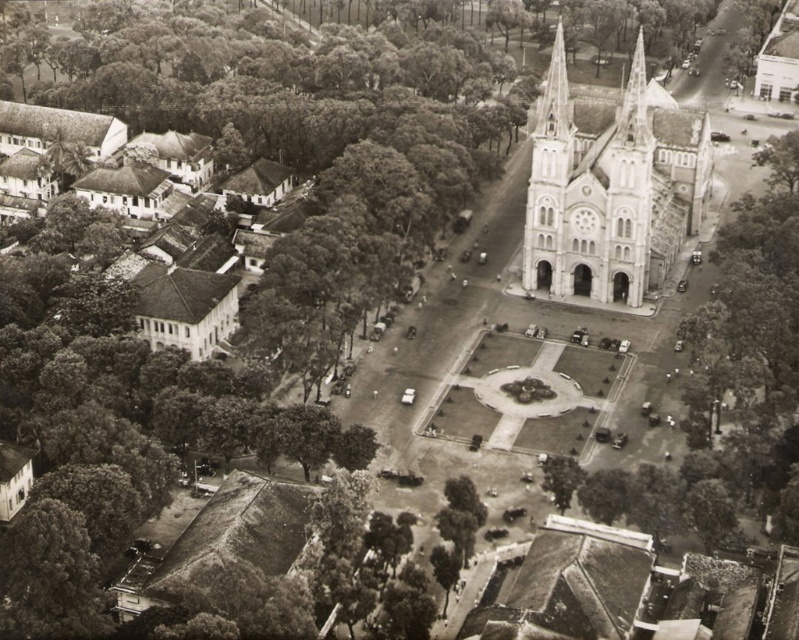
Can you confirm if dark green leafy tree at lower left is positioned below green leafy tree at center?

Indeed, dark green leafy tree at lower left is positioned under green leafy tree at center.

Between dark green leafy tree at lower left and green leafy tree at center, which one appears on the right side from the viewer's perspective?

green leafy tree at center is more to the right.

The width and height of the screenshot is (799, 640). I want to click on dark green leafy tree at lower left, so click(50, 573).

Is point (539, 186) positioned in front of point (48, 531)?

That is False.

Between stone church at center and dark green leafy tree at lower left, which one is positioned higher?

stone church at center is above.

Where is `stone church at center`? This screenshot has width=799, height=640. stone church at center is located at coordinates (611, 188).

In the scene shown: Is stone church at center above green leafy tree at center?

Correct, stone church at center is located above green leafy tree at center.

Based on the photo, which is more to the right, stone church at center or green leafy tree at center?

stone church at center is more to the right.

Between point (644, 253) and point (571, 490), which one is positioned behind?

The point (644, 253) is more distant.

Where is `stone church at center`? stone church at center is located at coordinates (611, 188).